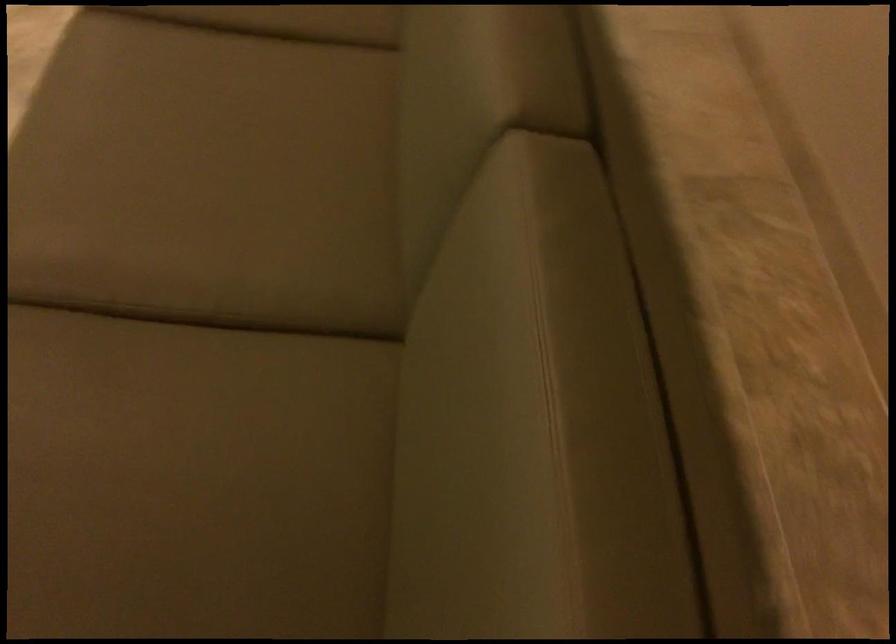
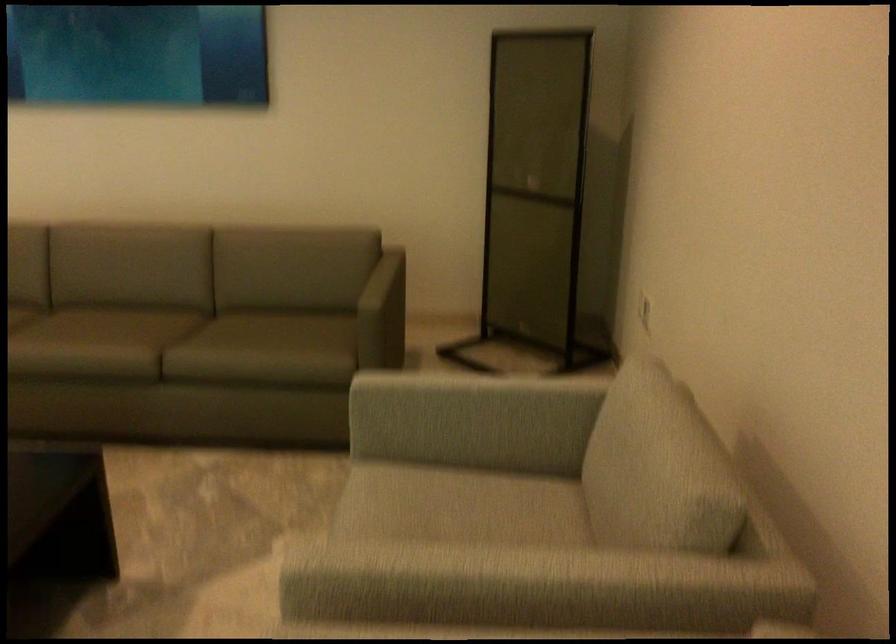
Find the pixel in the second image that matches point (204, 238) in the first image.

(128, 327)